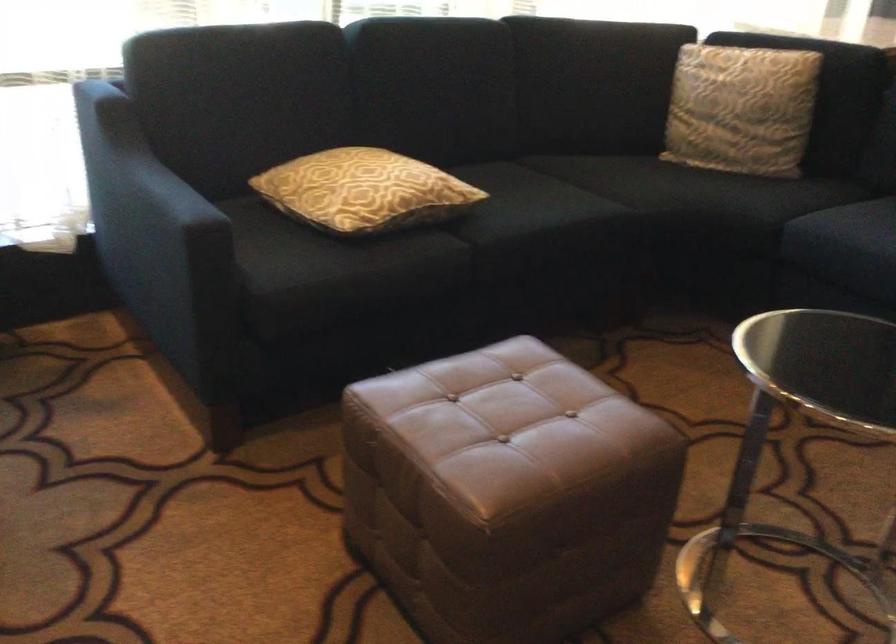
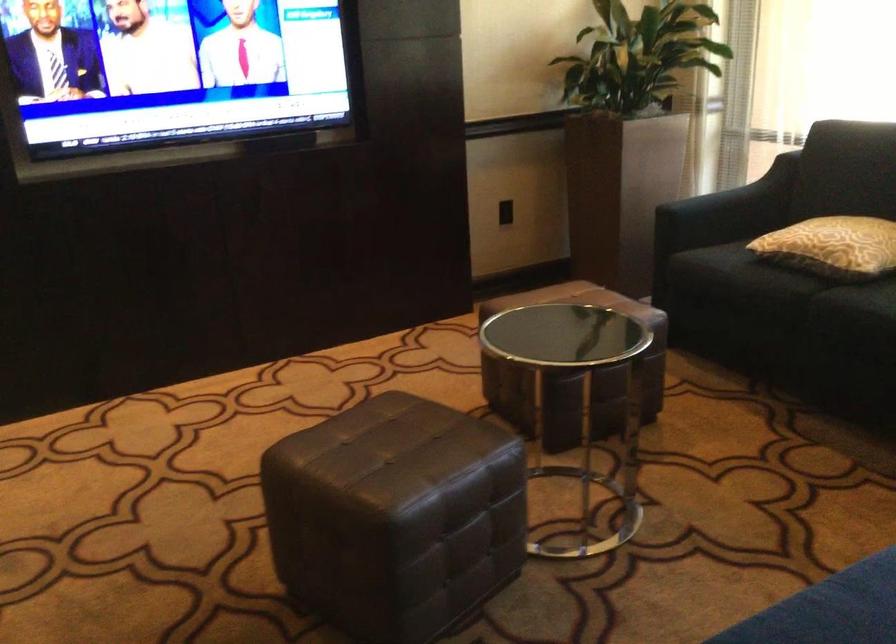
In the second image, find the point that corresponds to point 415,266 in the first image.

(767, 283)